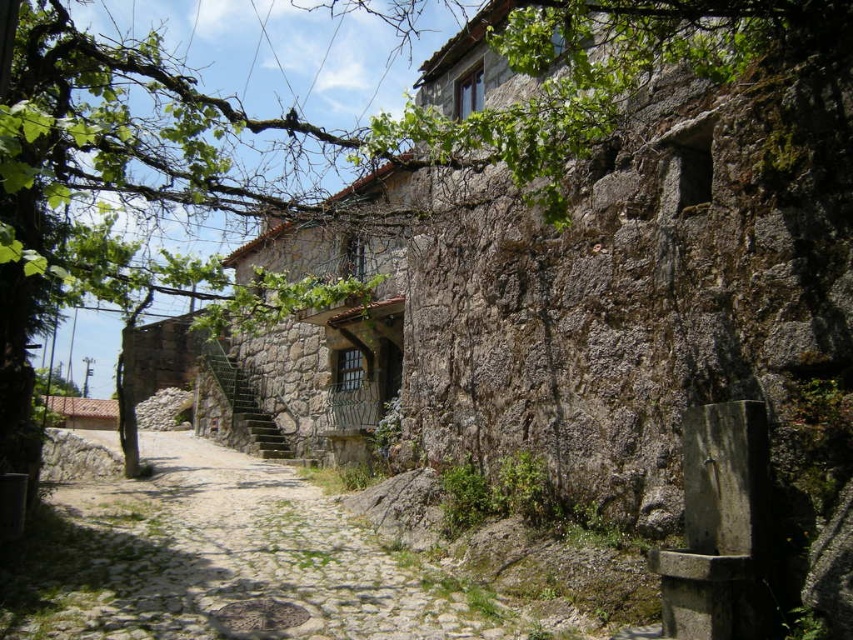
Question: Does cobblestone path at center come in front of rustic stone stairs at center?

Choices:
 (A) yes
 (B) no

Answer: (A)

Question: Which of the following is the farthest from the observer?

Choices:
 (A) (274, 435)
 (B) (83, 618)

Answer: (A)

Question: Which point is closer to the camera?

Choices:
 (A) (238, 404)
 (B) (310, 520)

Answer: (B)

Question: Where is cobblestone path at center located in relation to rustic stone stairs at center in the image?

Choices:
 (A) below
 (B) above

Answer: (A)

Question: Which point appears farthest from the camera in this image?

Choices:
 (A) click(x=225, y=355)
 (B) click(x=36, y=609)

Answer: (A)

Question: Does cobblestone path at center lie in front of rustic stone stairs at center?

Choices:
 (A) yes
 (B) no

Answer: (A)